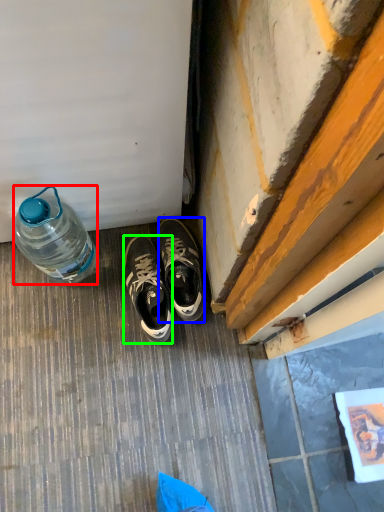
Question: Which is nearer to the bottle (highlighted by a red box)? sneakers (highlighted by a blue box) or sneakers (highlighted by a green box).

Choices:
 (A) sneakers
 (B) sneakers

Answer: (B)